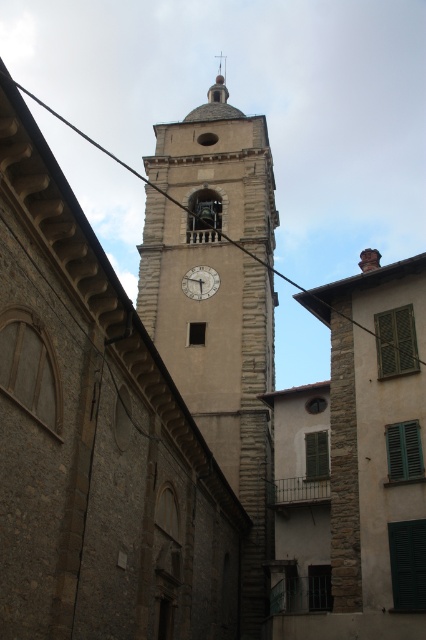
You are standing at a safe distance from the beige stone clock tower at center. If the recommended safe distance for taking a photo is 40 meters, can you take a photo without moving closer?

The beige stone clock tower at center and viewer are 44.51 meters apart from each other, so yes, you can take a photo without moving closer since the distance is already beyond the recommended 40 meters.

You are standing in front of the beige stone clock tower at center and want to take a photo of the white matte clock at center. To frame the shot properly, should you move to your left or right?

You should move to your left to frame the shot properly because the beige stone clock tower at center is to the right of the white matte clock at center, so moving left will position the clock in the frame without obstruction.

You are standing 20 meters away from the historic stone church tower. You notice a black wire at upper center. Can you reach it with a 20 meter long pole?

The black wire at upper center is 19.85 meters away from the viewer. Since the pole is 20 meters long, it can just barely reach the black wire at upper center.